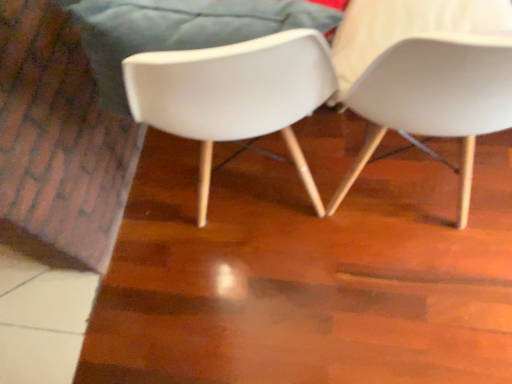
The width and height of the screenshot is (512, 384). Identify the location of free space underneath white matte chair at center, the 1th chair from the left (from a real-world perspective). (262, 184).